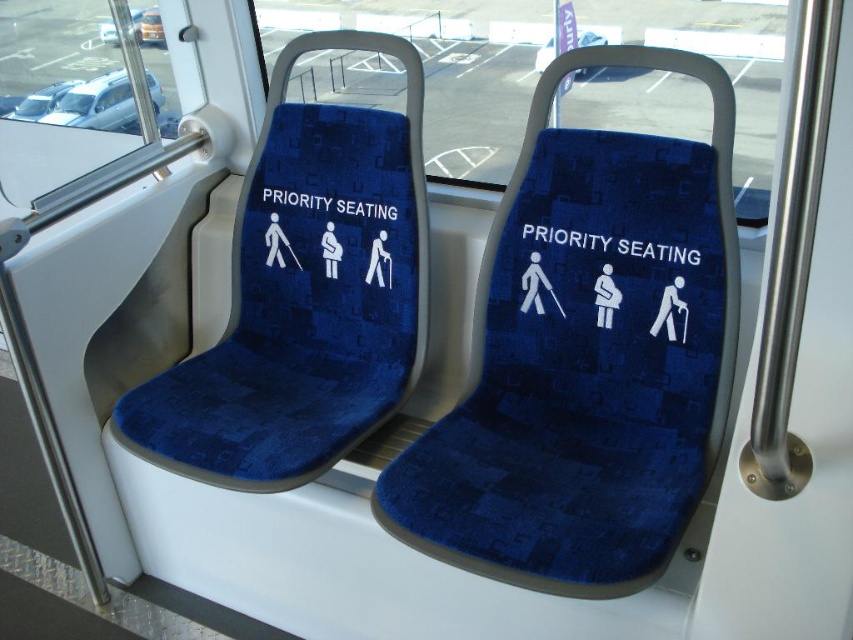
Question: Which of the following is the farthest from the observer?

Choices:
 (A) (593, 237)
 (B) (115, 129)
 (C) (357, 198)

Answer: (B)

Question: Is blue fabric priority seating at center wider than white fabric priority seating at center?

Choices:
 (A) yes
 (B) no

Answer: (B)

Question: Which of the following is the closest to the observer?

Choices:
 (A) blue fabric priority seating at center
 (B) white fabric priority seating at center
 (C) metallic silver car at upper left

Answer: (A)

Question: Does blue fabric priority seating at center appear on the left side of white fabric priority seating at center?

Choices:
 (A) no
 (B) yes

Answer: (A)

Question: Based on their relative distances, which object is nearer to the white fabric priority seating at center?

Choices:
 (A) blue fabric priority seating at center
 (B) metallic silver car at upper left

Answer: (A)

Question: Where is metallic silver car at upper left located in relation to white fabric priority seating at center in the image?

Choices:
 (A) above
 (B) below

Answer: (A)